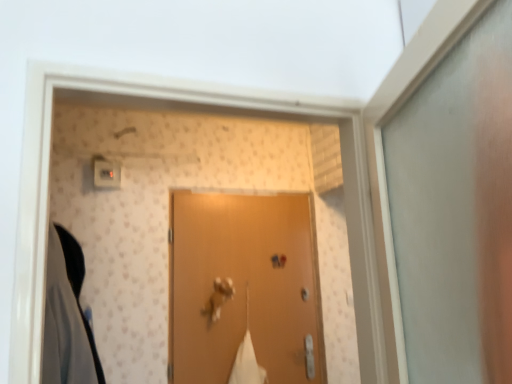
Question: From a real-world perspective, is matte brown door at center on matte plastic light switch at upper left?

Choices:
 (A) yes
 (B) no

Answer: (B)

Question: From the image's perspective, is matte brown door at center located beneath matte plastic light switch at upper left?

Choices:
 (A) no
 (B) yes

Answer: (B)

Question: Is matte brown door at center facing away from matte plastic light switch at upper left?

Choices:
 (A) no
 (B) yes

Answer: (A)

Question: Is matte brown door at center at the right side of matte plastic light switch at upper left?

Choices:
 (A) no
 (B) yes

Answer: (B)

Question: Does matte brown door at center have a greater height compared to matte plastic light switch at upper left?

Choices:
 (A) yes
 (B) no

Answer: (A)

Question: Considering their positions, is metallic gold door handle at center located in front of or behind matte brown door at center?

Choices:
 (A) behind
 (B) front

Answer: (A)

Question: From the image's perspective, is metallic gold door handle at center above or below matte brown door at center?

Choices:
 (A) above
 (B) below

Answer: (B)

Question: Considering the positions of metallic gold door handle at center and matte brown door at center in the image, is metallic gold door handle at center bigger or smaller than matte brown door at center?

Choices:
 (A) small
 (B) big

Answer: (A)

Question: Is metallic gold door handle at center to the left or to the right of matte brown door at center in the image?

Choices:
 (A) left
 (B) right

Answer: (A)

Question: Is metallic gold door handle at center wider or thinner than matte plastic light switch at upper left?

Choices:
 (A) wide
 (B) thin

Answer: (A)

Question: Is metallic gold door handle at center spatially inside matte plastic light switch at upper left, or outside of it?

Choices:
 (A) outside
 (B) inside

Answer: (A)

Question: Relative to matte plastic light switch at upper left, is metallic gold door handle at center in front or behind?

Choices:
 (A) behind
 (B) front

Answer: (A)

Question: Is metallic gold door handle at center bigger or smaller than matte plastic light switch at upper left?

Choices:
 (A) big
 (B) small

Answer: (A)

Question: From a real-world perspective, is matte brown door at center above or below metallic gold door handle at center?

Choices:
 (A) above
 (B) below

Answer: (A)

Question: From the image's perspective, is matte brown door at center located above or below metallic gold door handle at center?

Choices:
 (A) below
 (B) above

Answer: (B)